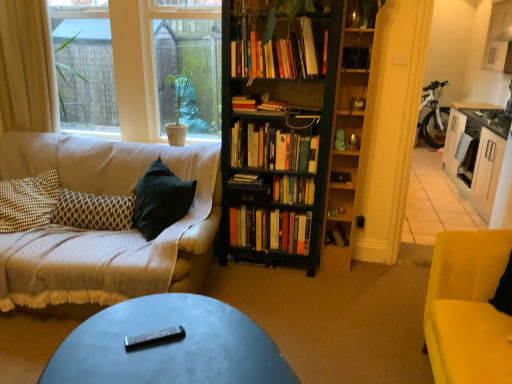
Where is `vacant area that is in front of wooden shelf at right`? vacant area that is in front of wooden shelf at right is located at coordinates [x=343, y=274].